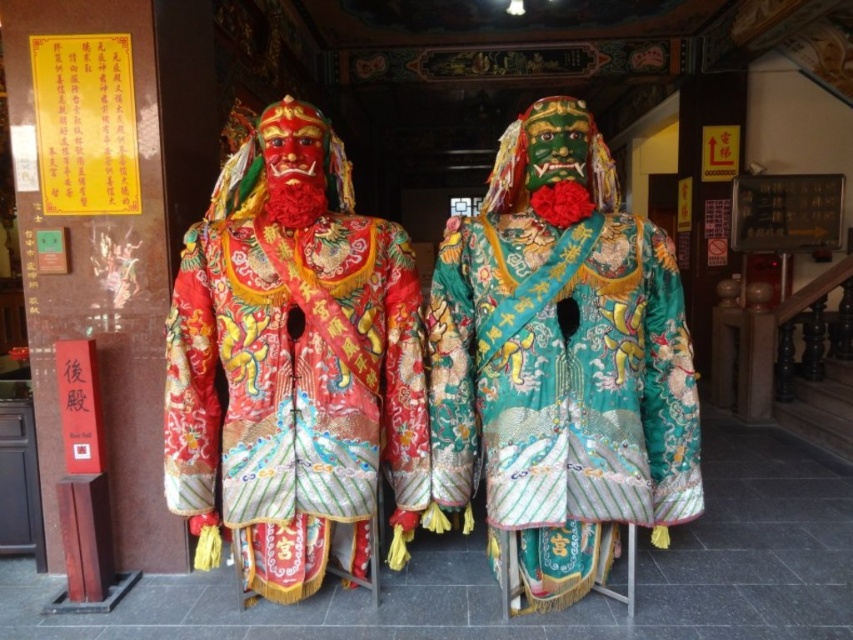
You are a temple visitor who wants to take a photo of both the shiny silk robe at center and the green satin robe at center. Since you want to capture both in one frame, which robe should you focus on to ensure both are visible?

The shiny silk robe at center is wider than the green satin robe at center, so focusing on the shiny silk robe at center would allow both to be captured in the frame since it occupies more space.